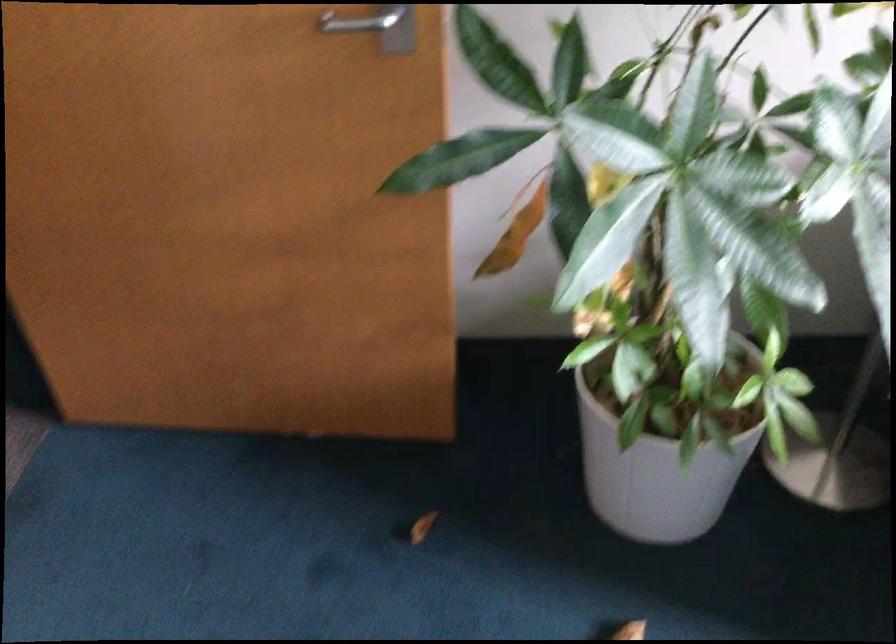
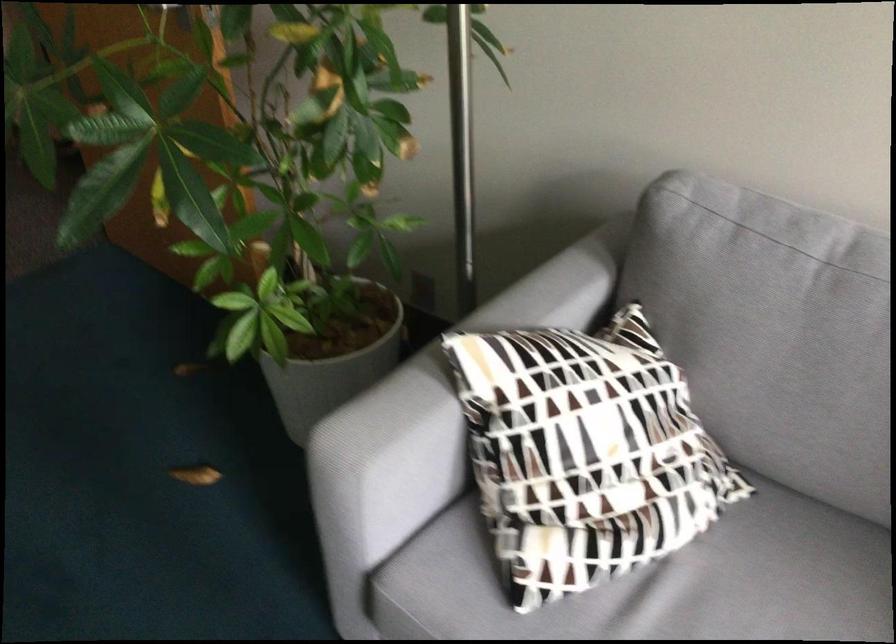
Find the pixel in the second image that matches the point at 772,412 in the first image.

(332, 355)